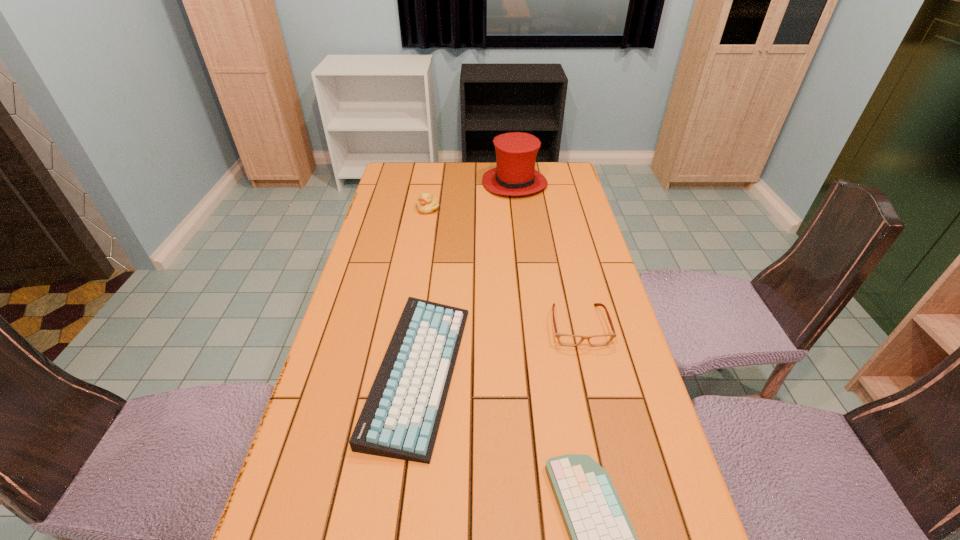
Find the location of `vacant region that satisfies the following two spatial constraints: 1. on the front-facing side of the fourth shortest object; 2. on the left side of the taller computer keyboard`. vacant region that satisfies the following two spatial constraints: 1. on the front-facing side of the fourth shortest object; 2. on the left side of the taller computer keyboard is located at coordinates (401, 373).